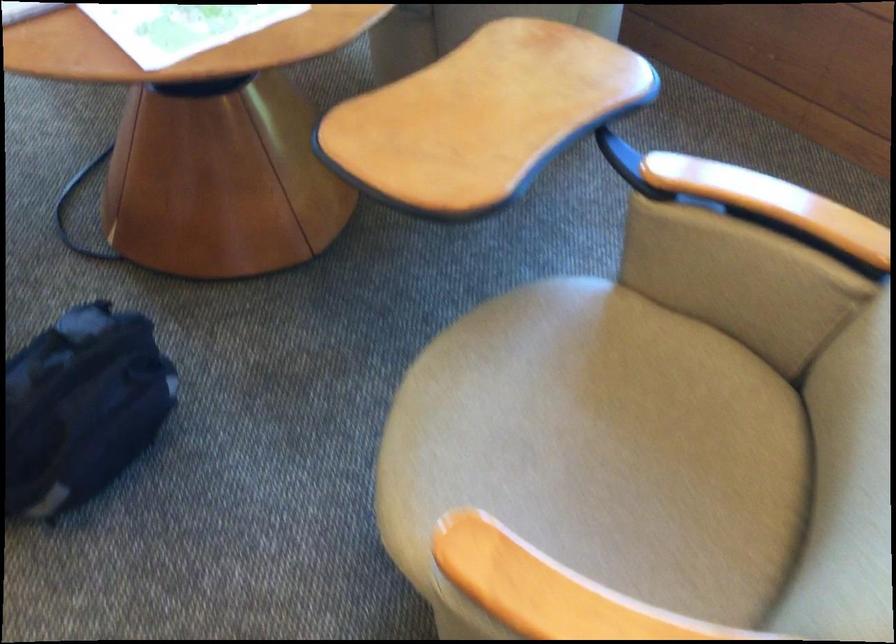
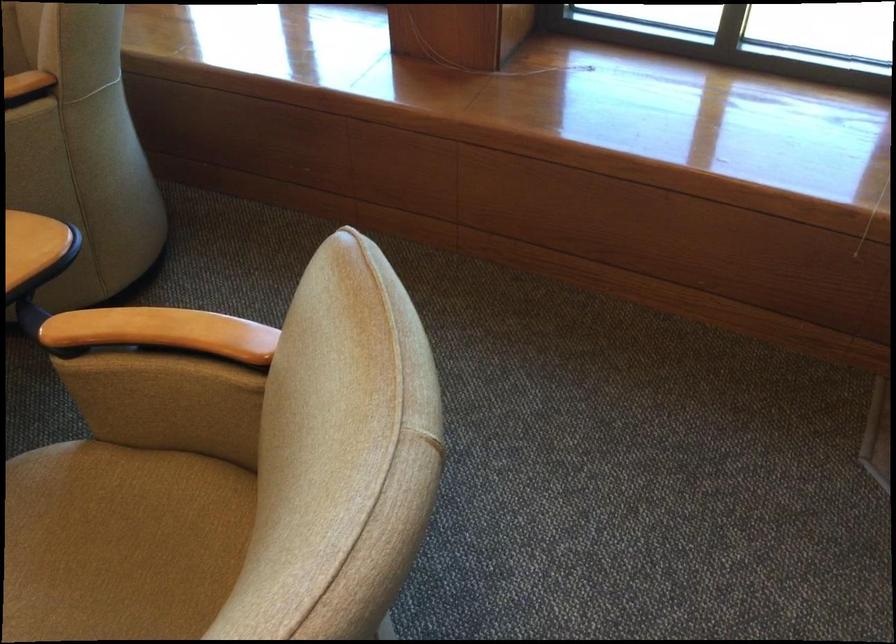
The point at (769, 199) is marked in the first image. Where is the corresponding point in the second image?

(161, 332)